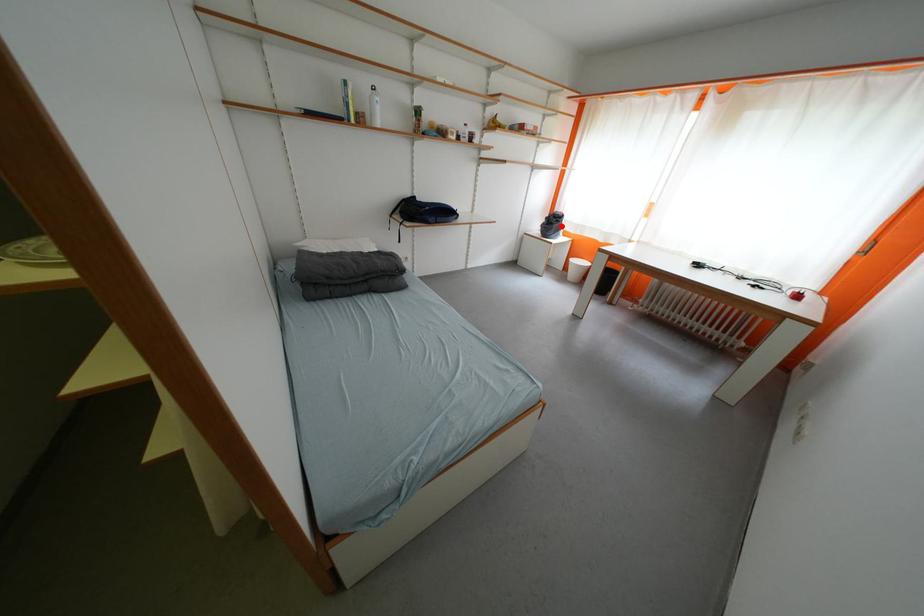
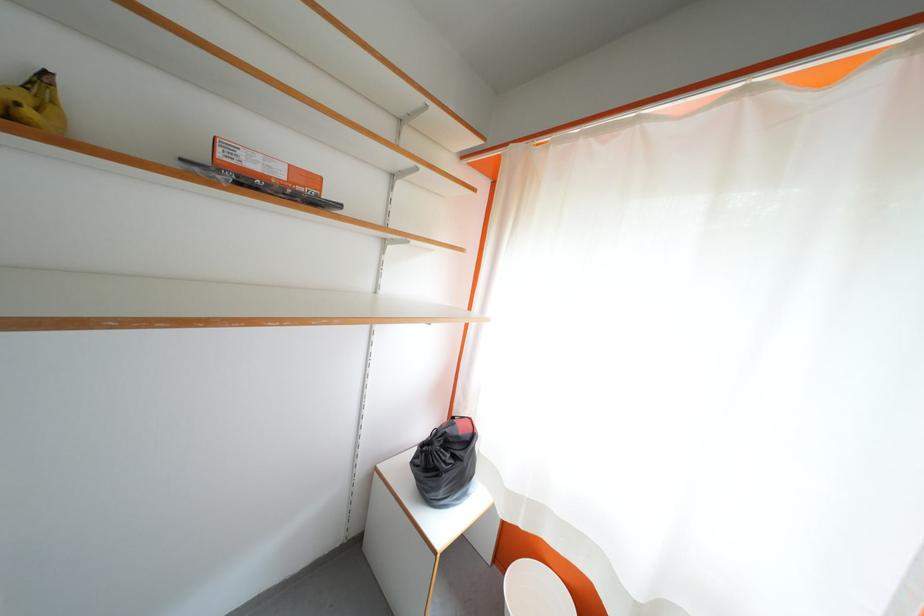
Question: I am providing you with two images of the same scene from different viewpoints. Given a red point in image1, look at the same physical point in image2. Is it:

Choices:
 (A) Closer to the viewpoint
 (B) Farther from the viewpoint

Answer: (B)